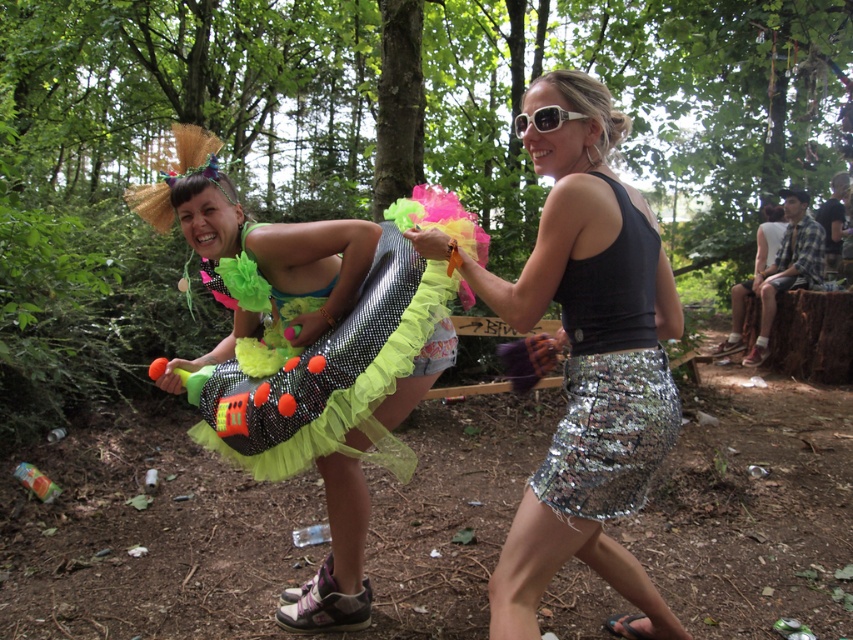
Does shiny sequin skirt at center have a lesser width compared to silver sequined skirt at center?

No, shiny sequin skirt at center is not thinner than silver sequined skirt at center.

Is point (535, 241) behind point (592, 321)?

Yes, point (535, 241) is behind point (592, 321).

Locate an element on the screen. The height and width of the screenshot is (640, 853). shiny sequin skirt at center is located at coordinates (589, 358).

Consider the image. Between shiny sequined dress at center and silver sequined skirt at center, which one has less height?

silver sequined skirt at center is shorter.

Does shiny sequined dress at center have a larger size compared to silver sequined skirt at center?

Indeed, shiny sequined dress at center has a larger size compared to silver sequined skirt at center.

Who is more distant from viewer, [277,324] or [590,452]?

Point [277,324]

At what (x,y) coordinates should I click in order to perform the action: click on shiny sequined dress at center. Please return your answer as a coordinate pair (x, y). Image resolution: width=853 pixels, height=640 pixels. Looking at the image, I should click on (311, 358).

In the scene shown: Which of these two, shiny sequined dress at center or glittery sequined dress at center, stands shorter?

glittery sequined dress at center is shorter.

Looking at this image, which is more to the right, shiny sequined dress at center or glittery sequined dress at center?

glittery sequined dress at center

Identify the location of shiny sequined dress at center. The image size is (853, 640). (311, 358).